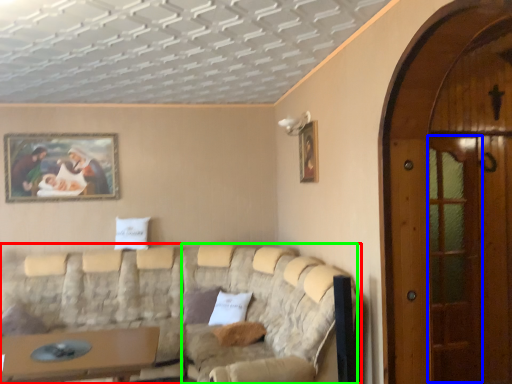
Question: Which is farther away from studio couch (highlighted by a red box)? screen door (highlighted by a blue box) or couch (highlighted by a green box)?

Choices:
 (A) screen door
 (B) couch

Answer: (A)